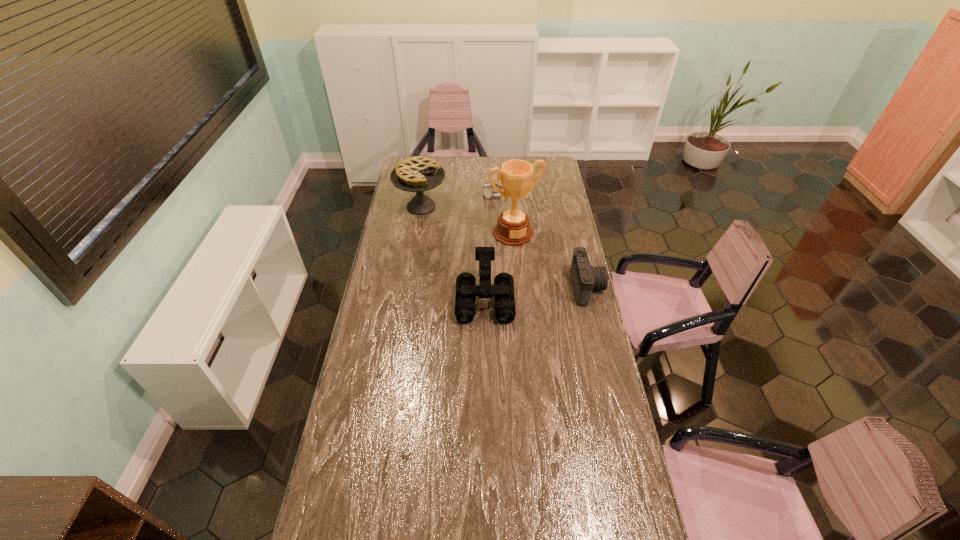
At what (x,y) coordinates should I click in order to perform the action: click on vacant space located 0.230m on the face of the watch. Please return your answer as a coordinate pair (x, y). This screenshot has height=540, width=960. Looking at the image, I should click on (506, 226).

The height and width of the screenshot is (540, 960). In order to click on free space located on the cut side of the pie in this screenshot , I will do `click(468, 242)`.

I want to click on vacant space situated on the cut side of the pie, so click(448, 228).

Where is `vacant region located on the cut side of the pie`? The height and width of the screenshot is (540, 960). vacant region located on the cut side of the pie is located at coordinates (443, 223).

You are a GUI agent. You are given a task and a screenshot of the screen. Output one action in this format:
    pyautogui.click(x=<x>, y=<y>)
    Task: Click on the free space located on the front-facing side of the tallest object
    The height and width of the screenshot is (540, 960).
    Given the screenshot: What is the action you would take?
    click(532, 265)

This screenshot has width=960, height=540. In order to click on vacant region located on the front-facing side of the tallest object in this screenshot , I will do `click(546, 290)`.

Locate an element on the screen. This screenshot has width=960, height=540. vacant space located on the front-facing side of the tallest object is located at coordinates (531, 263).

Where is `object located in the left edge section of the desktop`? object located in the left edge section of the desktop is located at coordinates (417, 174).

Identify the location of object present at the right edge. (585, 278).

Locate an element on the screen. The width and height of the screenshot is (960, 540). free spot at the far edge of the desktop is located at coordinates (489, 157).